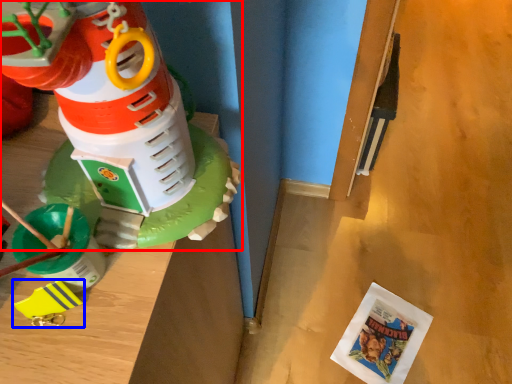
Question: Which of the following is the closest to the observer, toy (highlighted by a red box) or toy (highlighted by a blue box)?

Choices:
 (A) toy
 (B) toy

Answer: (A)